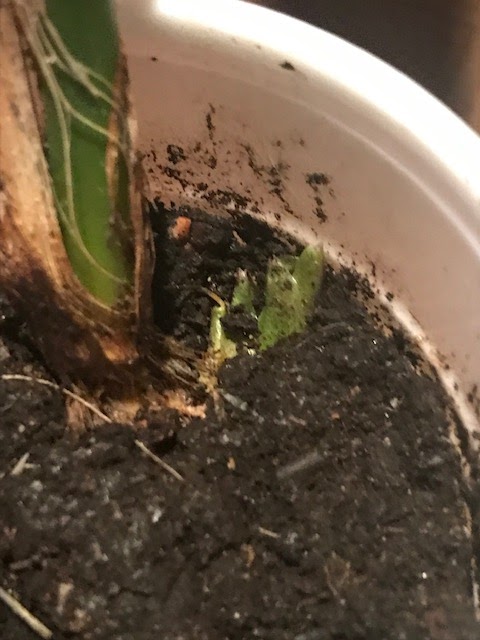
Image resolution: width=480 pixels, height=640 pixels. I want to click on top rim of pot, so click(369, 74).